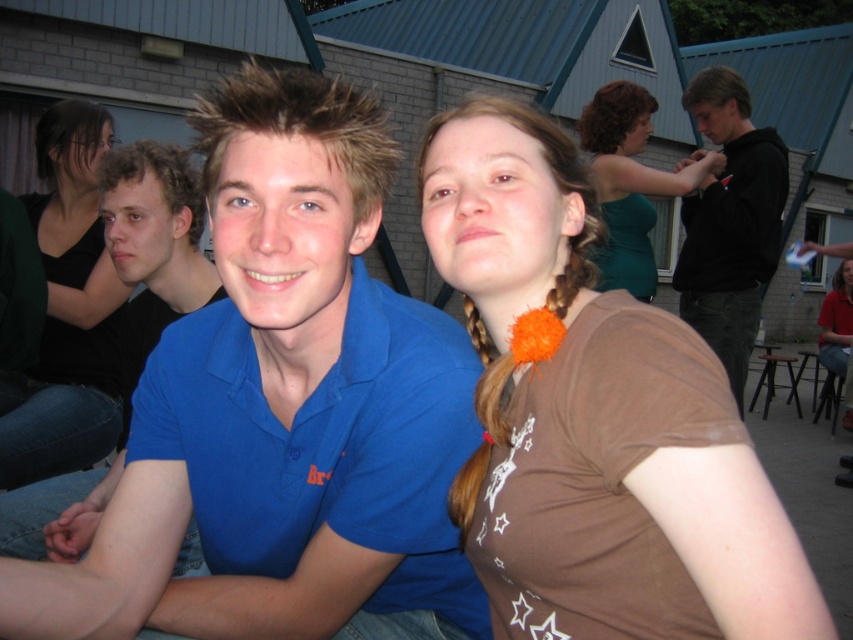
Based on the scene description, where is the brown fabric shirt at center located in the image?

The brown fabric shirt at center is located at point (595, 419) in the image.

You are standing in the crowd at this event and want to find the person wearing the brown fabric shirt at center and the green satin dress at upper center. Which of these two items of clothing is shorter in height?

The brown fabric shirt at center is shorter in height compared to the green satin dress at upper center.

You are standing at the position of the young man in the scene and want to move towards the point labeled as point (x=502, y=400). Is the point labeled as point (x=625, y=205) closer to you or further away than the point you are moving towards?

The point labeled as point (x=625, y=205) is further to the camera than point (x=502, y=400). Therefore, the point you are moving towards, point (x=502, y=400), is closer to you than point (x=625, y=205).